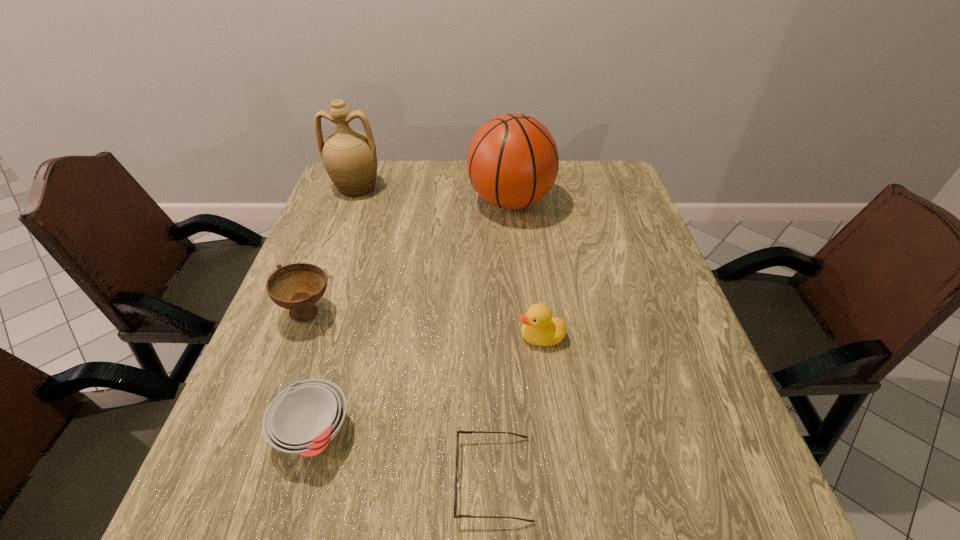
Identify the location of pitcher located at the left edge. The height and width of the screenshot is (540, 960). (349, 156).

Where is `object that is at the far left corner`? object that is at the far left corner is located at coordinates (349, 156).

I want to click on vacant space at the far edge of the desktop, so click(413, 186).

In the image, there is a desktop. Identify the location of vacant space at the near edge. The height and width of the screenshot is (540, 960). (290, 531).

Locate an element on the screen. The image size is (960, 540). vacant space at the left edge of the desktop is located at coordinates (364, 233).

Identify the location of vacant point at the right edge. (652, 323).

Locate an element on the screen. free space at the far left corner of the desktop is located at coordinates (384, 162).

Image resolution: width=960 pixels, height=540 pixels. Identify the location of vacant area at the far right corner of the desktop. (579, 198).

Locate an element on the screen. Image resolution: width=960 pixels, height=540 pixels. free space between the second shortest object and the pitcher is located at coordinates point(335,309).

What are the coordinates of `vacant area that lies between the third shortest object and the spectacles` in the screenshot? It's located at (517, 408).